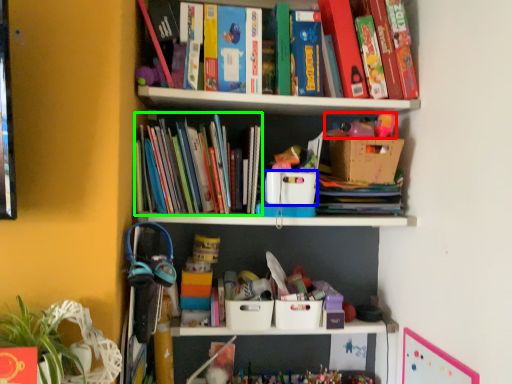
Question: Based on their relative distances, which object is farther from toy (highlighted by a red box)? Choose from storage box (highlighted by a blue box) and book (highlighted by a green box).

Choices:
 (A) storage box
 (B) book

Answer: (B)